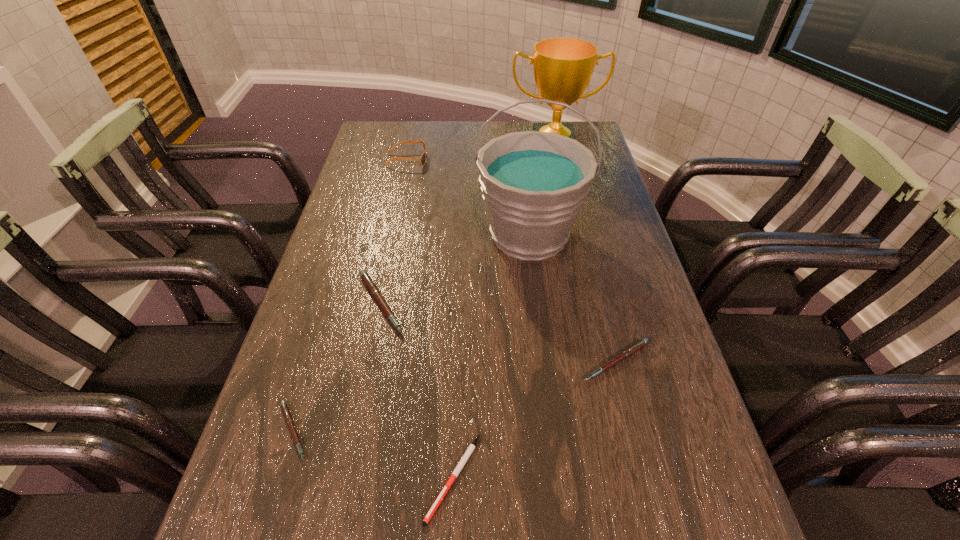
Identify the location of the second pen from right to left. (470, 449).

This screenshot has width=960, height=540. In order to click on vacant space situated 0.090m on the front of the fifth nearest object in this screenshot , I will do `click(537, 299)`.

Where is `vacant space located on the front-facing side of the gold award`? vacant space located on the front-facing side of the gold award is located at coordinates (571, 235).

Where is `vacant point located on the front-facing side of the third tallest object`? vacant point located on the front-facing side of the third tallest object is located at coordinates (447, 160).

Where is `free space located 0.190m at the nib of the biggest pink pen`? This screenshot has width=960, height=540. free space located 0.190m at the nib of the biggest pink pen is located at coordinates (488, 303).

You are a GUI agent. You are given a task and a screenshot of the screen. Output one action in this format:
    pyautogui.click(x=<x>, y=<y>)
    Task: Click on the free space located at the nib of the third shortest object
    Image resolution: width=960 pixels, height=540 pixels.
    Given the screenshot: What is the action you would take?
    pyautogui.click(x=658, y=524)

This screenshot has height=540, width=960. What are the coordinates of `free space located at the nib of the smallest pink pen` in the screenshot? It's located at (516, 431).

Image resolution: width=960 pixels, height=540 pixels. I want to click on award at the far edge, so click(x=563, y=67).

I want to click on sunglasses that is at the far edge, so click(422, 159).

Find the location of a particular element. sunglasses that is positioned at the left edge is located at coordinates (422, 159).